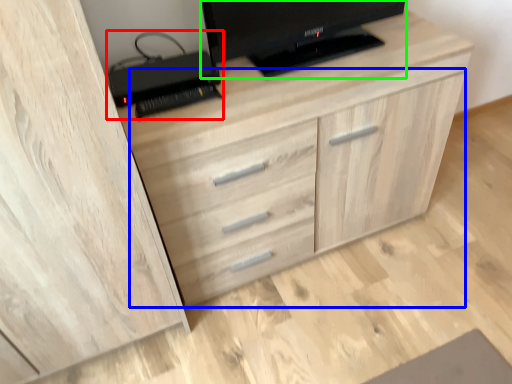
Question: Which is farther away from computer (highlighted by a red box)? dresser (highlighted by a blue box) or television (highlighted by a green box)?

Choices:
 (A) dresser
 (B) television

Answer: (A)